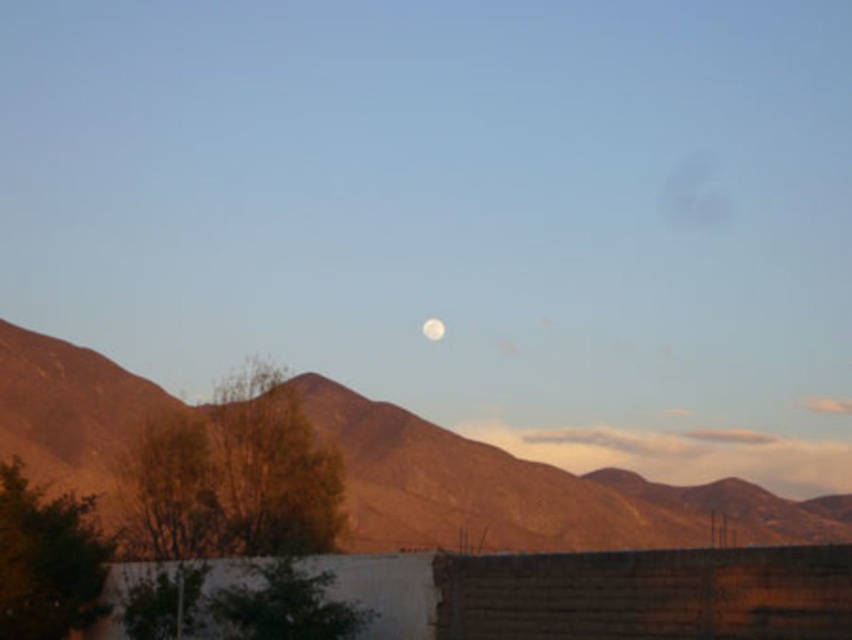
You are standing at the point marked as point (517, 492) in the image. What is the terrain like at your current location?

The point (517, 492) is on a brown rocky mountain range at center, so the terrain is rocky and mountainous.

You are an astronomer observing the sky and the landscape. You notice the brown rocky mountain range at center and the white glossy moon at center. Which object is located to the right of the other?

The brown rocky mountain range at center is positioned on the right side of white glossy moon at center.